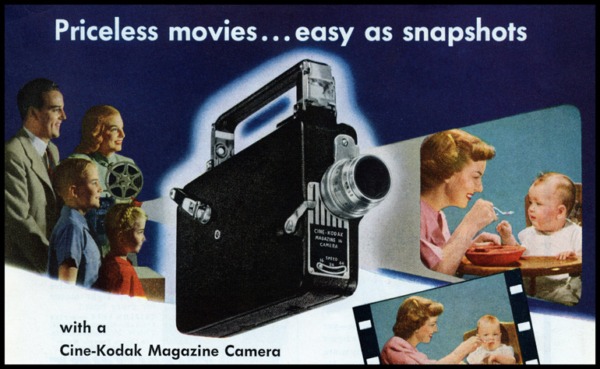
You are a GUI agent. You are given a task and a screenshot of the screen. Output one action in this format:
    pyautogui.click(x=<x>, y=<y>)
    Task: Click on the handle
    The height and width of the screenshot is (369, 600).
    Given the screenshot: What is the action you would take?
    pyautogui.click(x=277, y=88)